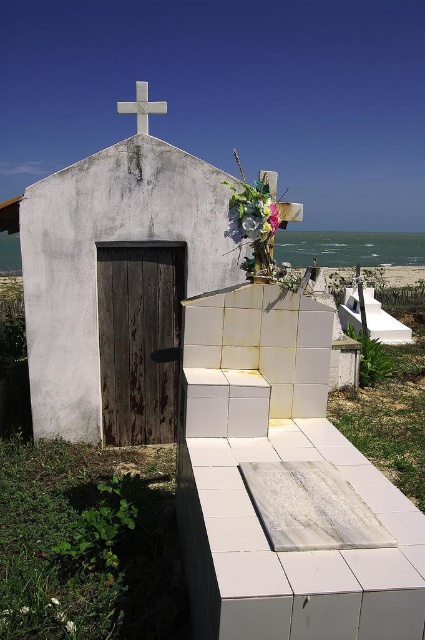
Which is above, white matte flower at upper center or white marble cross at upper center?

white marble cross at upper center is higher up.

Who is positioned more to the right, white matte flower at upper center or white marble cross at upper center?

Positioned to the right is white matte flower at upper center.

Which is behind, point (265, 196) or point (136, 131)?

Positioned behind is point (136, 131).

At what (x,y) coordinates should I click in order to perform the action: click on white matte flower at upper center. Please return your answer as a coordinate pair (x, y). Looking at the image, I should click on (252, 216).

Can you confirm if white matte cross at upper center is bigger than white matte flower at upper center?

Yes, white matte cross at upper center is bigger than white matte flower at upper center.

Which is behind, point (192, 248) or point (240, 227)?

Point (192, 248)

I want to click on white matte cross at upper center, so click(x=108, y=269).

Measure the distance between white matte cross at upper center and white marble cross at upper center.

A distance of 7.32 feet exists between white matte cross at upper center and white marble cross at upper center.

Where is `white matte cross at upper center`? The width and height of the screenshot is (425, 640). white matte cross at upper center is located at coordinates (108, 269).

Which is in front, point (235, 243) or point (147, 132)?

Positioned in front is point (147, 132).

You are a GUI agent. You are given a task and a screenshot of the screen. Output one action in this format:
    pyautogui.click(x=<x>, y=<y>)
    Task: Click on the white matte cross at upper center
    
    Given the screenshot: What is the action you would take?
    [x=108, y=269]